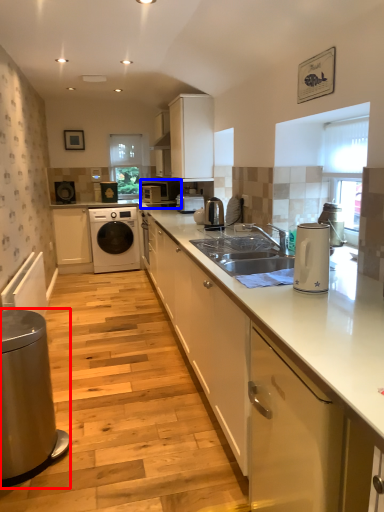
Question: Which object is closer to the camera taking this photo, home appliance (highlighted by a red box) or home appliance (highlighted by a blue box)?

Choices:
 (A) home appliance
 (B) home appliance

Answer: (A)